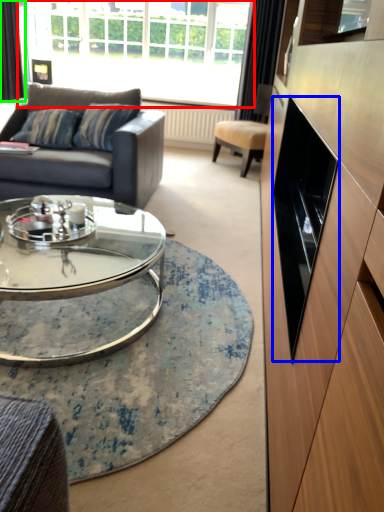
Question: Estimate the real-world distances between objects in this image. Which object is farther from window (highlighted by a red box), drawer (highlighted by a blue box) or curtain (highlighted by a green box)?

Choices:
 (A) drawer
 (B) curtain

Answer: (A)